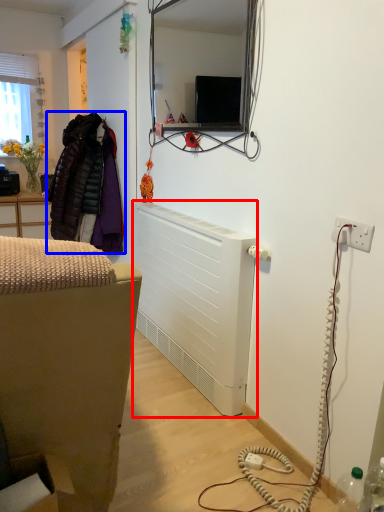
Question: Among these objects, which one is farthest to the camera, radiator (highlighted by a red box) or jacket (highlighted by a blue box)?

Choices:
 (A) radiator
 (B) jacket

Answer: (B)